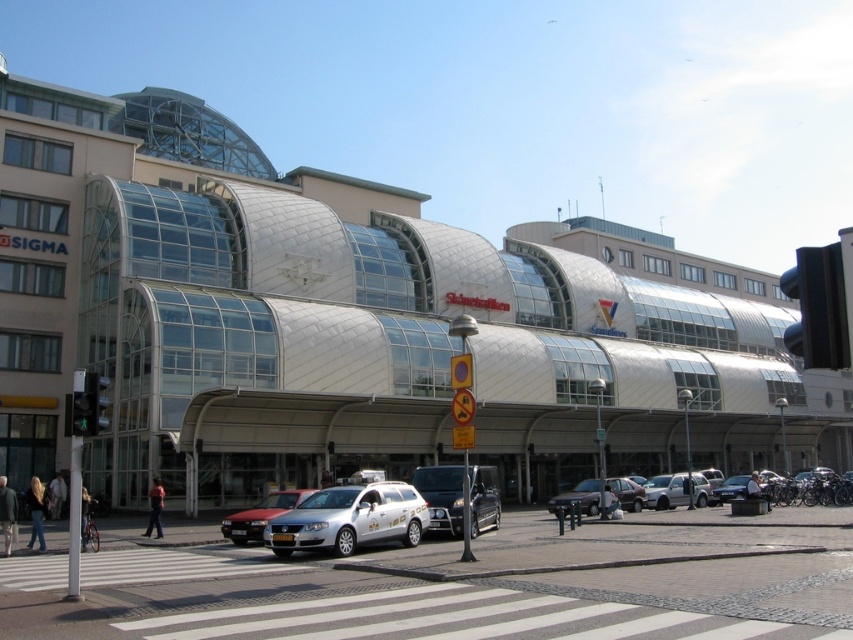
Is green matte pedestrian signal at lower left below green glass traffic light at center?

Correct, green matte pedestrian signal at lower left is located below green glass traffic light at center.

Does green matte pedestrian signal at lower left appear on the right side of green glass traffic light at center?

No, green matte pedestrian signal at lower left is not to the right of green glass traffic light at center.

Where is `green matte pedestrian signal at lower left`? This screenshot has height=640, width=853. green matte pedestrian signal at lower left is located at coordinates (80, 413).

You are a GUI agent. You are given a task and a screenshot of the screen. Output one action in this format:
    pyautogui.click(x=<x>, y=<y>)
    Task: Click on the green matte pedestrian signal at lower left
    This screenshot has width=853, height=640.
    Given the screenshot: What is the action you would take?
    tap(80, 413)

Does silver metallic station wagon at center have a larger size compared to green glass traffic light at center?

Actually, silver metallic station wagon at center might be smaller than green glass traffic light at center.

Between point (265, 538) and point (107, 381), which one is positioned behind?

The point (265, 538) is behind.

At what (x,y) coordinates should I click in order to perform the action: click on silver metallic station wagon at center. Please return your answer as a coordinate pair (x, y). Looking at the image, I should click on (349, 518).

Is dark gray metallic van at center taller than green glass traffic light at center?

Indeed, dark gray metallic van at center has a greater height compared to green glass traffic light at center.

Find the location of `dark gray metallic van at center`. dark gray metallic van at center is located at coordinates (440, 496).

Is point (483, 522) positioned behind point (86, 384)?

Yes, it is behind point (86, 384).

At what (x,y) coordinates should I click in order to perform the action: click on dark gray metallic van at center. Please return your answer as a coordinate pair (x, y). Looking at the image, I should click on (440, 496).